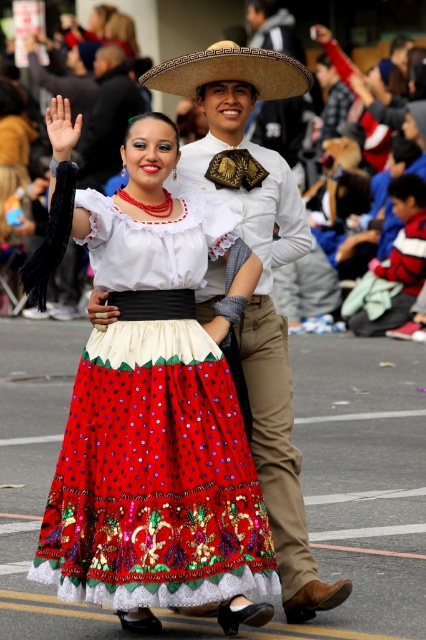
You are a photographer standing at the camera position. You want to capture a closeup shot of the matte white shirt at center. Given that your camera can focus on objects within 5 meters, will you be able to take the photo without moving closer?

The matte white shirt at center is 7.27 meters away from the camera, which is beyond the 5 meter focus range. Therefore, you cannot take a closeup shot without moving closer.

You are a photographer trying to capture both the embroidered cotton skirt at center and the matte straw hat at center in a single frame. Based on their sizes, which object should you focus on to ensure both are visible without cropping?

The embroidered cotton skirt at center is wider than the matte straw hat at center, so focusing on the wider embroidered cotton skirt at center will ensure both objects are visible in the frame.

From the picture: You are a photographer trying to capture a clear shot of both the embroidered cotton skirt at center and the brown woven straw hat at upper center during the parade. Which object should you focus on first to ensure it appears sharp in your photo?

You should focus on the embroidered cotton skirt at center first because it is closer to the viewer than the brown woven straw hat at upper center. By focusing on the closer object, you can ensure that both will be in focus if they are within the camera lens depth of field.